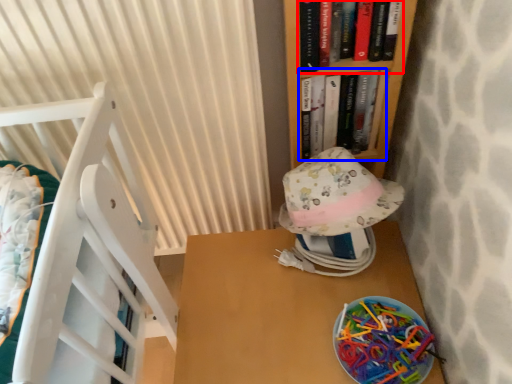
Question: Among these objects, which one is nearest to the camera, book (highlighted by a red box) or book (highlighted by a blue box)?

Choices:
 (A) book
 (B) book

Answer: (A)